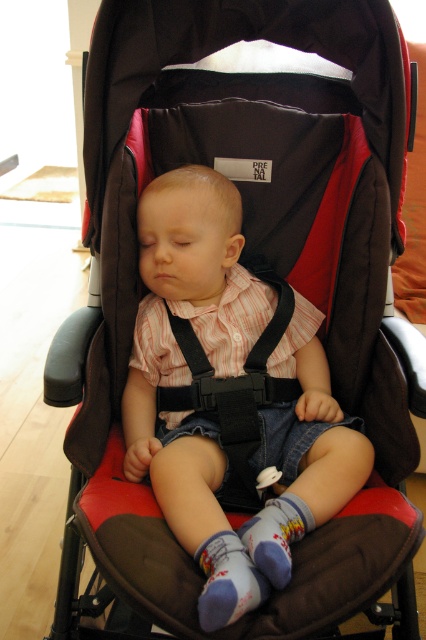
Is black fabric strap at center thinner than printed cotton sock at center?

No, black fabric strap at center is not thinner than printed cotton sock at center.

Does black fabric strap at center appear over printed cotton sock at center?

Indeed, black fabric strap at center is positioned over printed cotton sock at center.

Is point (193, 380) positioned before point (261, 513)?

That is False.

Locate an element on the screen. The height and width of the screenshot is (640, 426). black fabric strap at center is located at coordinates (235, 392).

Is purple soft socks at lower center to the right of printed cotton sock at center from the viewer's perspective?

Incorrect, purple soft socks at lower center is not on the right side of printed cotton sock at center.

Is purple soft socks at lower center shorter than printed cotton sock at center?

Yes.

Where is `purple soft socks at lower center`? The height and width of the screenshot is (640, 426). purple soft socks at lower center is located at coordinates (227, 580).

Where is `purple soft socks at lower center`? The width and height of the screenshot is (426, 640). purple soft socks at lower center is located at coordinates (227, 580).

Is black fabric strap at center to the left of purple soft socks at lower center from the viewer's perspective?

In fact, black fabric strap at center is to the right of purple soft socks at lower center.

Is black fabric strap at center closer to camera compared to purple soft socks at lower center?

No, black fabric strap at center is further to the viewer.

Is point (256, 339) positioned behind point (210, 589)?

Yes, it is behind point (210, 589).

At what (x,y) coordinates should I click in order to perform the action: click on black fabric strap at center. Please return your answer as a coordinate pair (x, y). The width and height of the screenshot is (426, 640). Looking at the image, I should click on (235, 392).